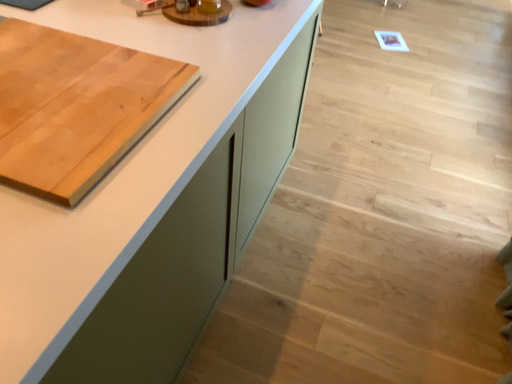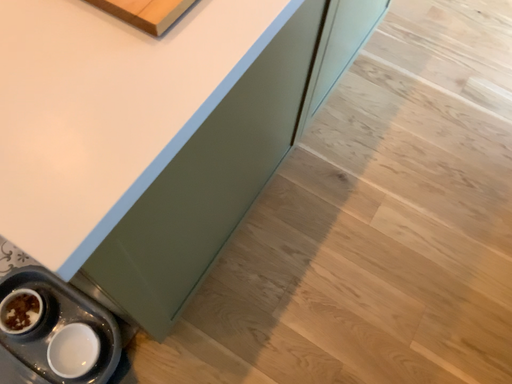
Question: How did the camera likely rotate when shooting the video?

Choices:
 (A) rotated left
 (B) rotated right

Answer: (A)